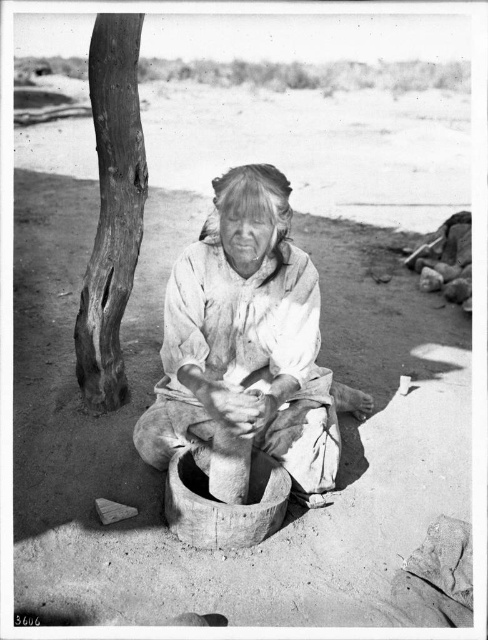
Question: Is the position of white clothed woman at center more distant than that of smooth bark tree trunk at left?

Choices:
 (A) yes
 (B) no

Answer: (B)

Question: Which of the following is the farthest from the observer?

Choices:
 (A) smooth bark tree trunk at left
 (B) white clothed woman at center

Answer: (A)

Question: Can you confirm if white clothed woman at center is smaller than smooth bark tree trunk at left?

Choices:
 (A) no
 (B) yes

Answer: (A)

Question: Can you confirm if white clothed woman at center is thinner than smooth bark tree trunk at left?

Choices:
 (A) yes
 (B) no

Answer: (B)

Question: Among these points, which one is nearest to the camera?

Choices:
 (A) coord(100,410)
 (B) coord(245,321)

Answer: (B)